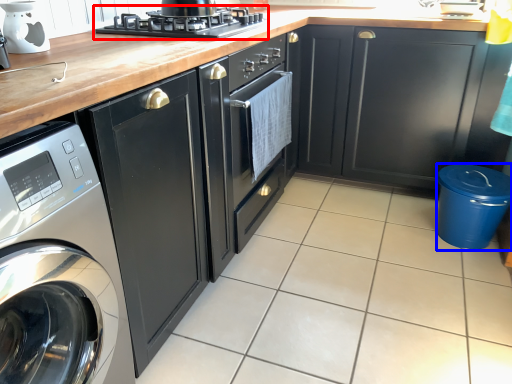
Question: Which point is further to the camera, kitchen appliance (highlighted by a red box) or appliance (highlighted by a blue box)?

Choices:
 (A) kitchen appliance
 (B) appliance

Answer: (B)